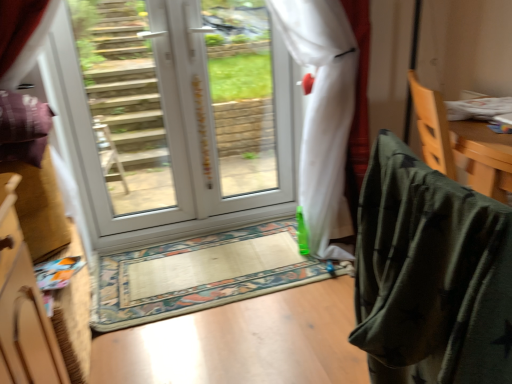
Question: Is beige fabric doormat at center wider or thinner than transparent plastic window screen at center?

Choices:
 (A) wide
 (B) thin

Answer: (A)

Question: Based on their positions, is beige fabric doormat at center located to the left or right of transparent plastic window screen at center?

Choices:
 (A) right
 (B) left

Answer: (B)

Question: Estimate the real-world distances between objects in this image. Which object is closer to the white glossy door at center?

Choices:
 (A) white glossy glass door at upper center
 (B) camouflage fabric bag at right
 (C) wooden cabinet at left
 (D) dark green fabric at right
 (E) beige fabric doormat at center

Answer: (A)

Question: Which is farther from the wooden cabinet at left?

Choices:
 (A) white glossy glass door at upper center
 (B) transparent plastic window screen at center
 (C) white glossy door at center
 (D) camouflage fabric bag at right
 (E) beige fabric doormat at center

Answer: (B)